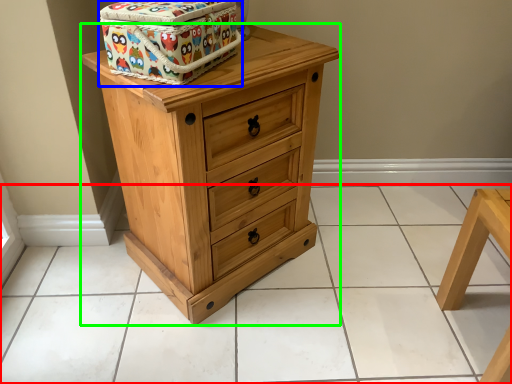
Question: Considering the real-world distances, which object is closest to tile (highlighted by a red box)? cardboard box (highlighted by a blue box) or chest of drawers (highlighted by a green box).

Choices:
 (A) cardboard box
 (B) chest of drawers

Answer: (B)